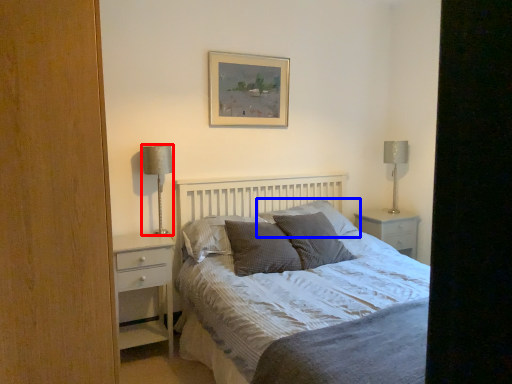
Question: Which object is further to the camera taking this photo, table lamp (highlighted by a red box) or pillow (highlighted by a blue box)?

Choices:
 (A) table lamp
 (B) pillow

Answer: (B)